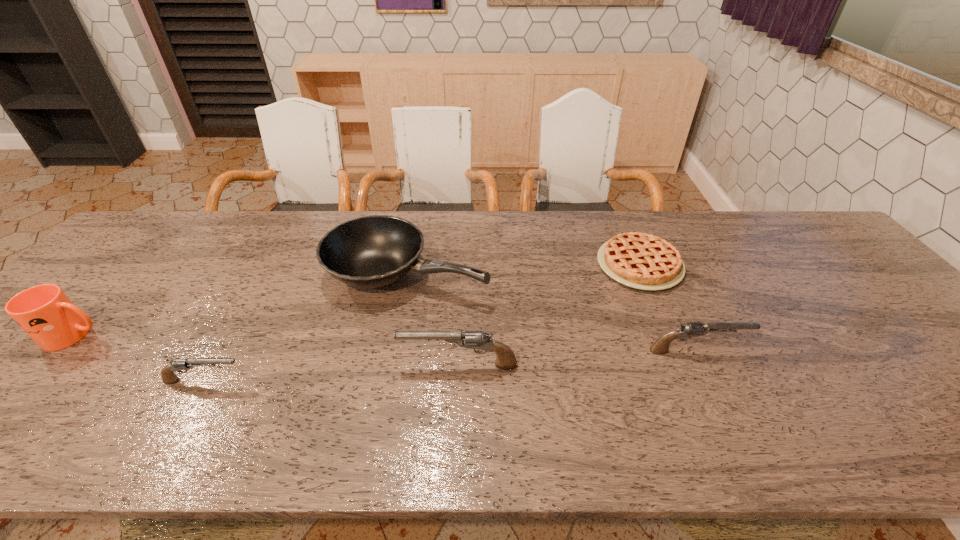
Please show where to add a gun on the right while keeping spacing even. Please provide its 2D coordinates. Your answer should be formatted as a tuple, i.e. [(x, y)], where the tuple contains the x and y coordinates of a point satisfying the conditions above.

[(922, 337)]